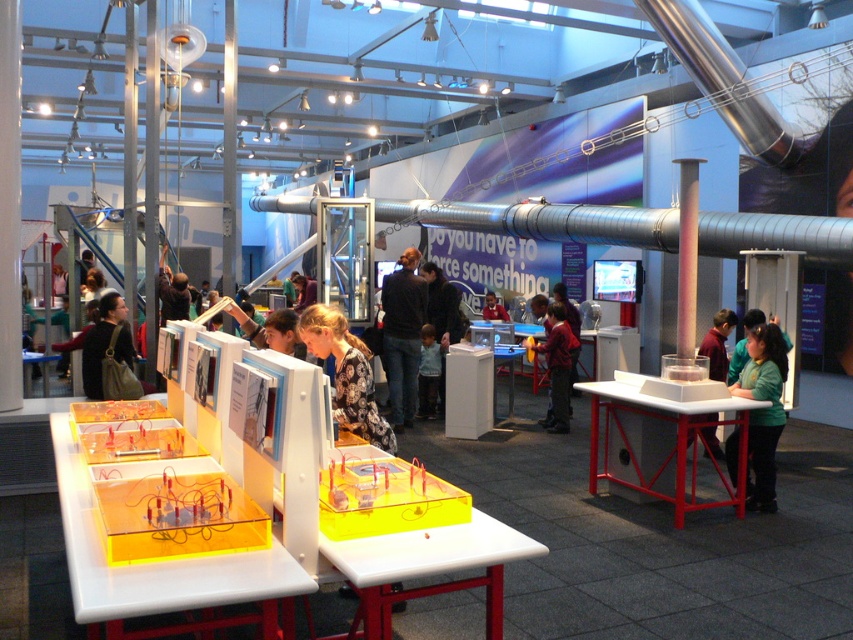
Question: Is matte black jacket at left thinner than red shirt at center?

Choices:
 (A) no
 (B) yes

Answer: (A)

Question: Which is nearer to the green matte shirt at lower right?

Choices:
 (A) green fabric shirt at right
 (B) matte black jacket at left
 (C) light blue shirt at center

Answer: (A)

Question: Does white plastic table at center have a smaller size compared to green matte shirt at lower right?

Choices:
 (A) no
 (B) yes

Answer: (A)

Question: Is translucent yellow plastic at center above green matte shirt at lower right?

Choices:
 (A) yes
 (B) no

Answer: (B)

Question: Which of the following is the closest to the observer?

Choices:
 (A) (776, 364)
 (B) (474, 548)
 (C) (706, 445)

Answer: (B)

Question: Which point appears farthest from the camera in this image?

Choices:
 (A) (772, 346)
 (B) (722, 401)
 (C) (548, 420)

Answer: (C)